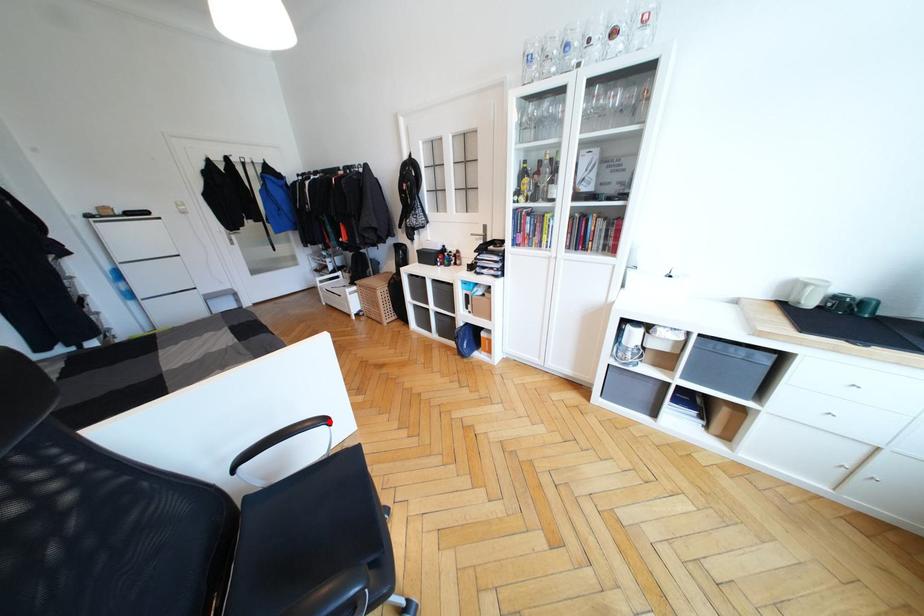
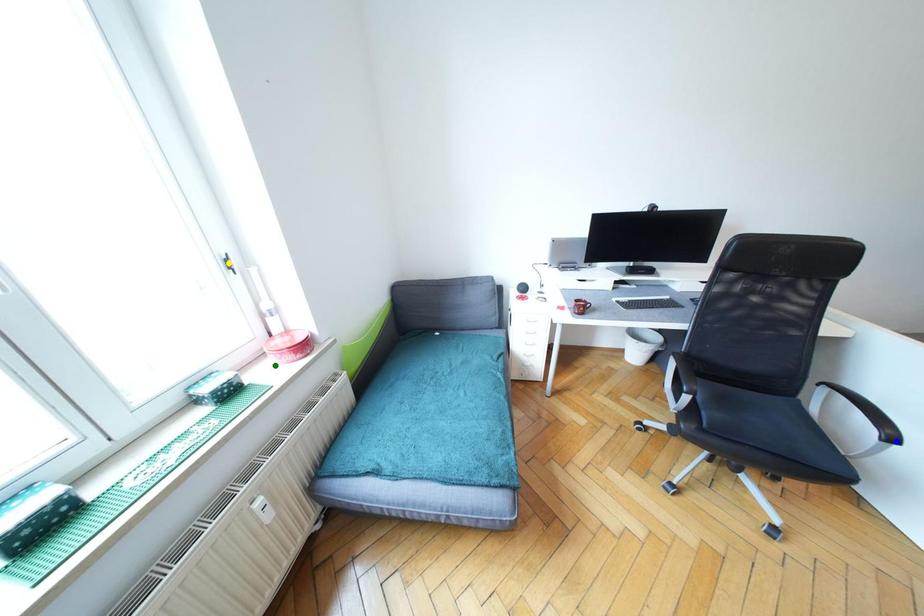
Question: I am providing you with two images of the same scene from different viewpoints. A red point is marked on the first image. You are given multiple points on the second image. Which point in image 2 is actually the same real-world point as the red point in image 1?

Choices:
 (A) green point
 (B) yellow point
 (C) blue point

Answer: (C)